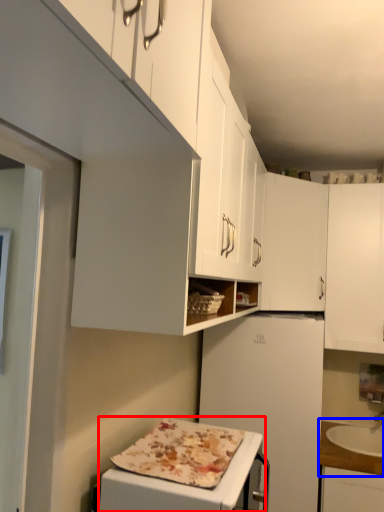
Question: Which point is closer to the camera, appliance (highlighted by a red box) or countertop (highlighted by a blue box)?

Choices:
 (A) appliance
 (B) countertop

Answer: (A)